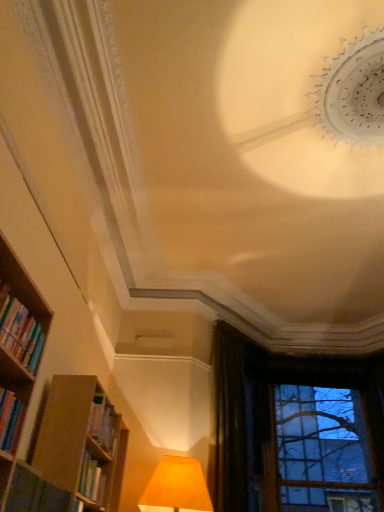
Question: Is transparent glass window at lower right closer to camera compared to hardcover book at lower left, the second book when ordered from top to bottom?

Choices:
 (A) yes
 (B) no

Answer: (B)

Question: Considering the relative sizes of transparent glass window at lower right and hardcover book at lower left, the second book when ordered from top to bottom, in the image provided, is transparent glass window at lower right wider than hardcover book at lower left, the second book when ordered from top to bottom,?

Choices:
 (A) yes
 (B) no

Answer: (A)

Question: Is transparent glass window at lower right at the right side of hardcover book at lower left, the second book when ordered from top to bottom?

Choices:
 (A) no
 (B) yes

Answer: (B)

Question: From the image's perspective, does transparent glass window at lower right appear higher than hardcover book at lower left, the second book when ordered from top to bottom?

Choices:
 (A) yes
 (B) no

Answer: (B)

Question: Is transparent glass window at lower right far away from hardcover book at lower left, the second book when ordered from top to bottom?

Choices:
 (A) yes
 (B) no

Answer: (A)

Question: Is transparent glass window at lower right situated inside hardcover book at lower left, the second book when ordered from top to bottom, or outside?

Choices:
 (A) inside
 (B) outside

Answer: (B)

Question: Based on their positions, is transparent glass window at lower right located to the left or right of hardcover book at lower left, the second book when ordered from top to bottom?

Choices:
 (A) right
 (B) left

Answer: (A)

Question: From a real-world perspective, is transparent glass window at lower right above or below hardcover book at lower left, the second book when ordered from top to bottom?

Choices:
 (A) below
 (B) above

Answer: (B)

Question: Considering their positions, is transparent glass window at lower right located in front of or behind hardcover book at lower left, the second book when ordered from top to bottom?

Choices:
 (A) front
 (B) behind

Answer: (B)

Question: Considering the positions of hardcover books at left, the second book ordered from the bottom, and dark velvet curtain at upper right in the image, is hardcover books at left, the second book ordered from the bottom, wider or thinner than dark velvet curtain at upper right?

Choices:
 (A) wide
 (B) thin

Answer: (A)

Question: From the image's perspective, relative to dark velvet curtain at upper right, is hardcover books at left, the second book ordered from the bottom, above or below?

Choices:
 (A) below
 (B) above

Answer: (B)

Question: Is hardcover books at left, the second book ordered from the bottom, in front of or behind dark velvet curtain at upper right in the image?

Choices:
 (A) front
 (B) behind

Answer: (A)

Question: From a real-world perspective, relative to dark velvet curtain at upper right, is hardcover books at left, the second book ordered from the bottom, vertically above or below?

Choices:
 (A) below
 (B) above

Answer: (A)

Question: Is transparent glass window at lower right taller or shorter than dark velvet curtain at upper right?

Choices:
 (A) tall
 (B) short

Answer: (B)

Question: Is transparent glass window at lower right in front of or behind dark velvet curtain at upper right in the image?

Choices:
 (A) behind
 (B) front

Answer: (A)